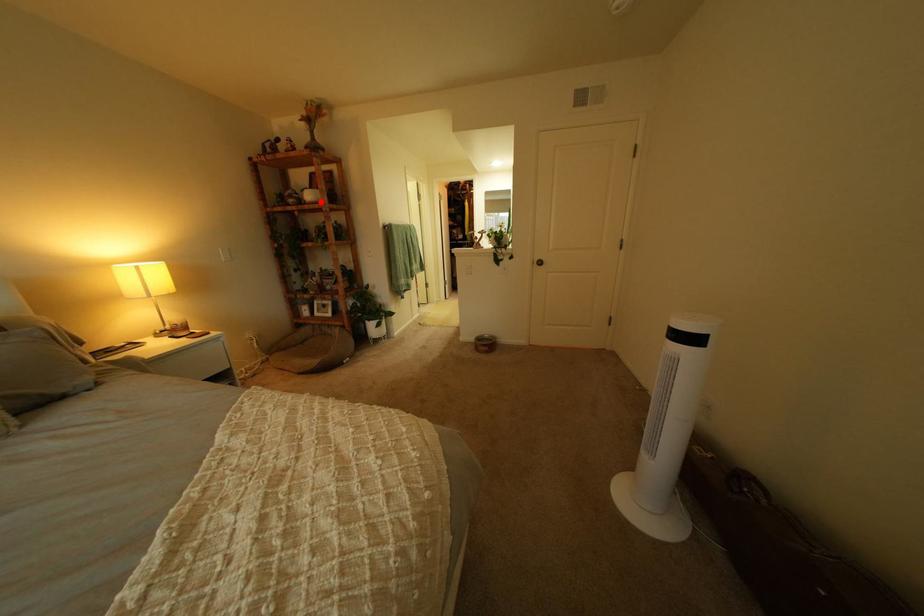
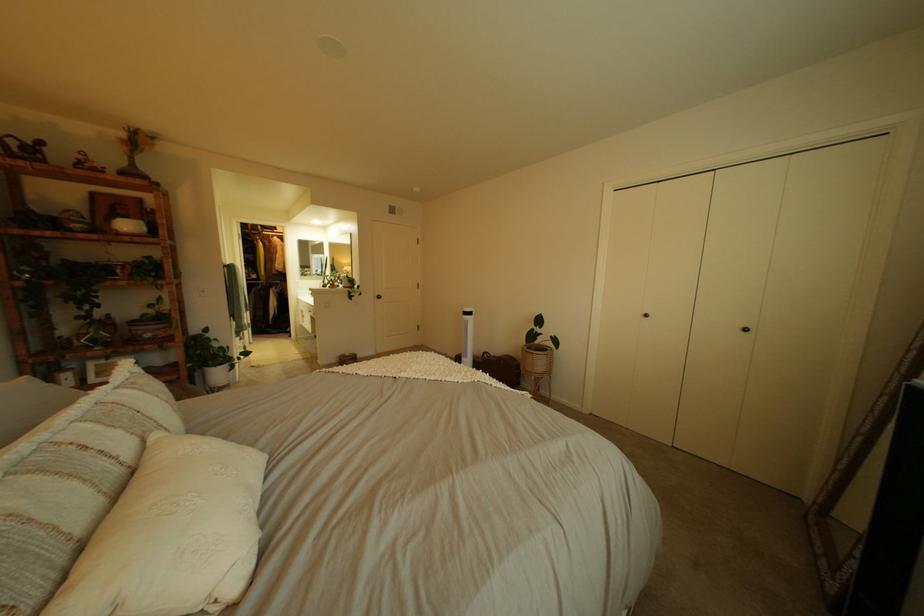
Question: I am providing you with two images of the same scene from different viewpoints. Image1 has a red point marked. In image2, the corresponding 3D location appears at what relative position? Reply with the corresponding letter.

Choices:
 (A) Closer
 (B) Farther

Answer: (B)